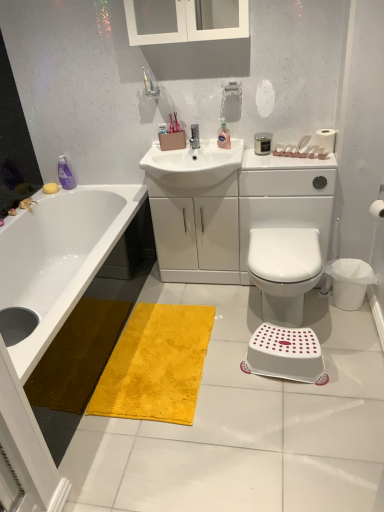
Question: Does yellow matte soap at upper left appear on the right side of white plastic bidet at center?

Choices:
 (A) no
 (B) yes

Answer: (A)

Question: Can you confirm if yellow matte soap at upper left is thinner than white plastic bidet at center?

Choices:
 (A) yes
 (B) no

Answer: (A)

Question: Is white plastic bidet at center completely or partially inside yellow matte soap at upper left?

Choices:
 (A) yes
 (B) no

Answer: (B)

Question: Can you confirm if yellow matte soap at upper left is smaller than white plastic bidet at center?

Choices:
 (A) yes
 (B) no

Answer: (A)

Question: Is yellow matte soap at upper left aimed at white plastic bidet at center?

Choices:
 (A) no
 (B) yes

Answer: (B)

Question: Is yellow matte soap at upper left shorter than white plastic bidet at center?

Choices:
 (A) yes
 (B) no

Answer: (A)

Question: Considering the relative sizes of white paper at upper right, which is counted as the second toilet paper, starting from the front, and white glossy sink at center in the image provided, is white paper at upper right, which is counted as the second toilet paper, starting from the front, bigger than white glossy sink at center?

Choices:
 (A) yes
 (B) no

Answer: (B)

Question: Considering the relative sizes of white paper at upper right, which appears as the 2th toilet paper when ordered from the bottom, and white glossy sink at center in the image provided, is white paper at upper right, which appears as the 2th toilet paper when ordered from the bottom, smaller than white glossy sink at center?

Choices:
 (A) yes
 (B) no

Answer: (A)

Question: Can we say white paper at upper right, the 1th toilet paper viewed from the top, lies outside white glossy sink at center?

Choices:
 (A) yes
 (B) no

Answer: (A)

Question: Is white paper at upper right, the 1th toilet paper viewed from the top, positioned behind white glossy sink at center?

Choices:
 (A) no
 (B) yes

Answer: (B)

Question: Is white paper at upper right, placed as the 1th toilet paper when sorted from back to front, at the right side of white glossy sink at center?

Choices:
 (A) yes
 (B) no

Answer: (A)

Question: Does white paper at upper right, which is the first toilet paper from left to right, have a lesser width compared to white glossy sink at center?

Choices:
 (A) yes
 (B) no

Answer: (A)

Question: Is the position of white paper at upper right, the 1th toilet paper viewed from the top, less distant than that of white matte toilet paper at right, arranged as the first toilet paper when viewed from the front?

Choices:
 (A) yes
 (B) no

Answer: (B)